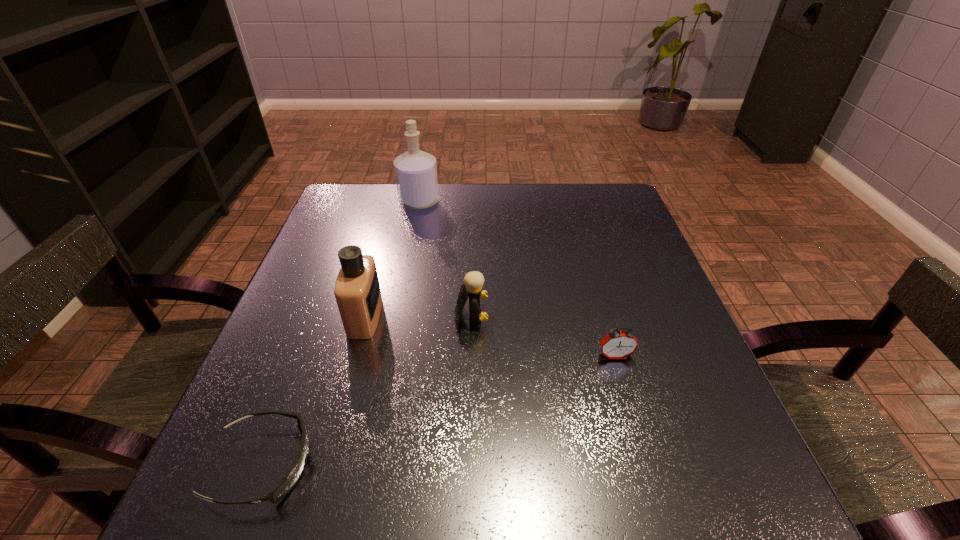
This screenshot has height=540, width=960. In order to click on vacant space located on the right of the tallest object in this screenshot , I will do `click(457, 202)`.

Locate an element on the screen. This screenshot has height=540, width=960. blank area located on the front label of the nearer perfume is located at coordinates (443, 317).

Where is `free location located on the front-facing side of the third tallest object`? This screenshot has width=960, height=540. free location located on the front-facing side of the third tallest object is located at coordinates [599, 316].

Find the location of a particular element. The height and width of the screenshot is (540, 960). vacant space positioned on the clock face of the fourth tallest object is located at coordinates (657, 501).

At what (x,y) coordinates should I click in order to perform the action: click on vacant space located on the lenses of the shortest object. Please return your answer as a coordinate pair (x, y). Looking at the image, I should click on (514, 465).

At what (x,y) coordinates should I click in order to perform the action: click on object that is at the far edge. Please return your answer as a coordinate pair (x, y). Looking at the image, I should click on (415, 171).

Locate an element on the screen. The image size is (960, 540). object present at the near edge is located at coordinates (293, 475).

Locate an element on the screen. perfume at the left edge is located at coordinates (357, 291).

The image size is (960, 540). Identify the location of goggles that is at the left edge. (293, 475).

Find the location of a particular element. object present at the right edge is located at coordinates (617, 344).